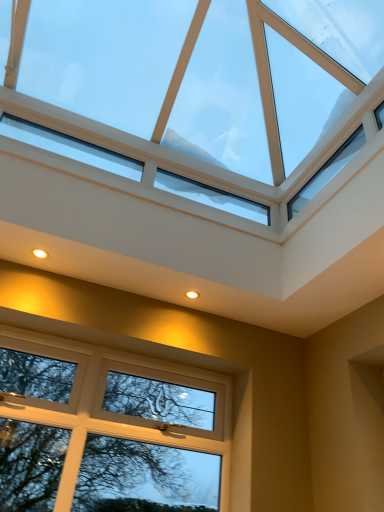
At what (x,y) coordinates should I click in order to perform the action: click on transparent glass window at upper center. Please return your answer as a coordinate pair (x, y). The image size is (384, 512). Looking at the image, I should click on (273, 83).

Describe the element at coordinates (273, 83) in the screenshot. I see `transparent glass window at upper center` at that location.

You are a GUI agent. You are given a task and a screenshot of the screen. Output one action in this format:
    pyautogui.click(x=<x>, y=<y>)
    Task: Click on the transparent glass window at upper center
    
    Given the screenshot: What is the action you would take?
    pyautogui.click(x=273, y=83)